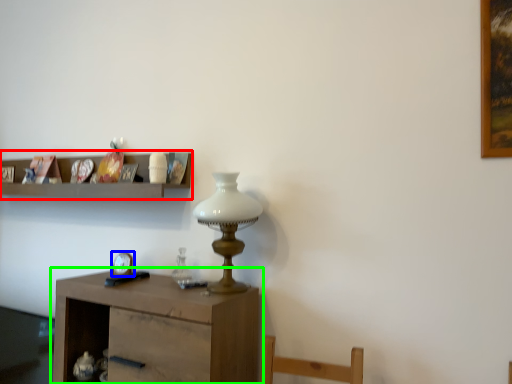
Question: Based on their relative distances, which object is farther from shelf (highlighted by a red box)? Choose from clock (highlighted by a blue box) and table (highlighted by a green box).

Choices:
 (A) clock
 (B) table

Answer: (B)